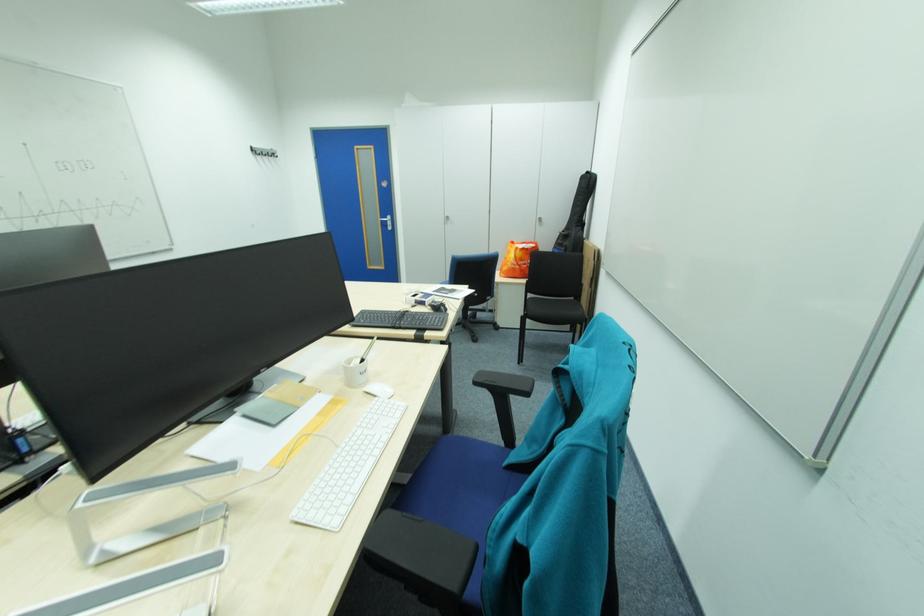
You are a GUI agent. You are given a task and a screenshot of the screen. Output one action in this format:
    pyautogui.click(x=<x>, y=<y>)
    Task: Click on the white pen cup
    
    Given the screenshot: What is the action you would take?
    pyautogui.click(x=355, y=371)